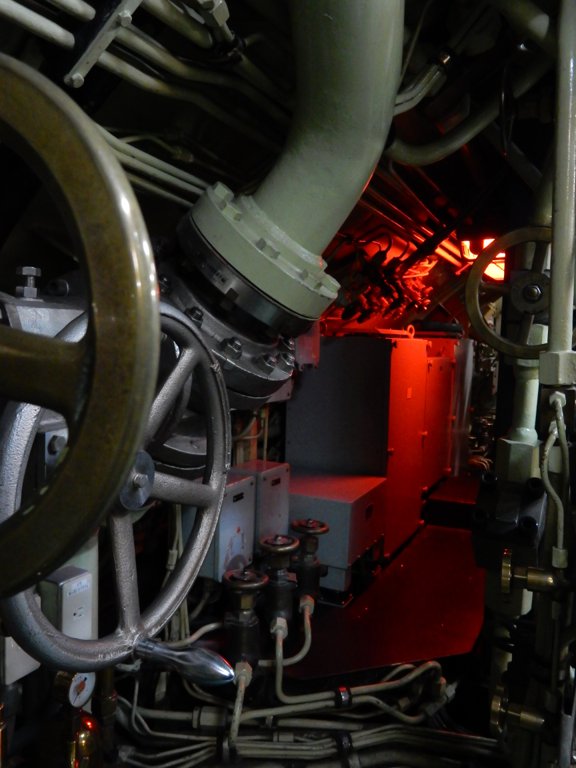
Locate an element on the screen. cabinets is located at coordinates (378, 395), (431, 391), (365, 528).